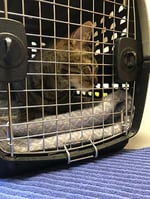
Image resolution: width=150 pixels, height=199 pixels. Identify the location of door on crate. (103, 125).